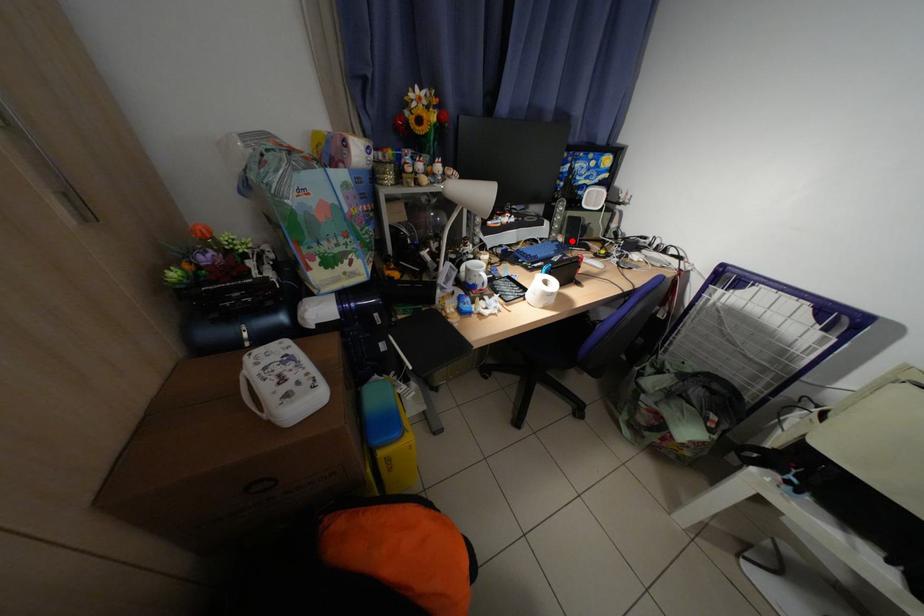
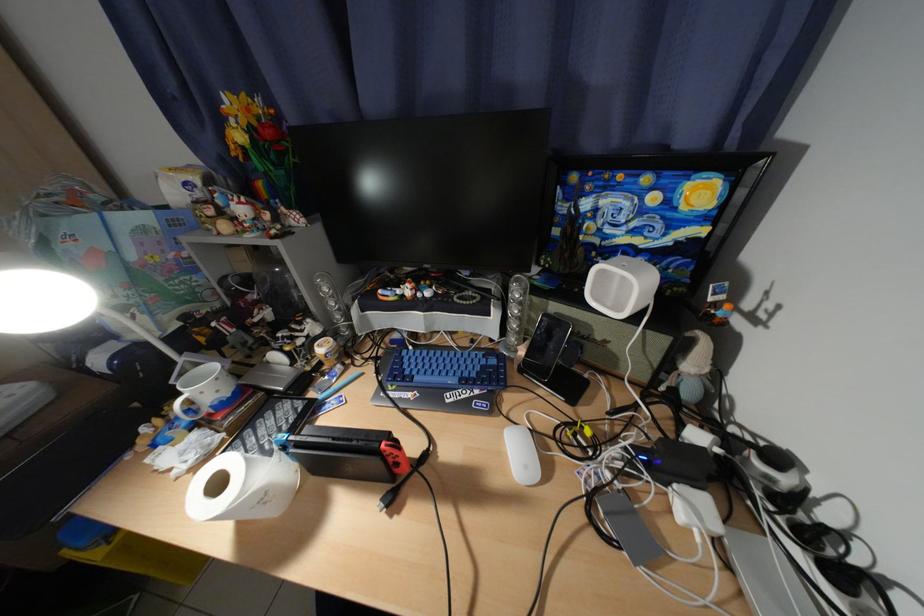
Locate, in the second image, the point that corresponds to the highlighted location in the first image.

(533, 354)